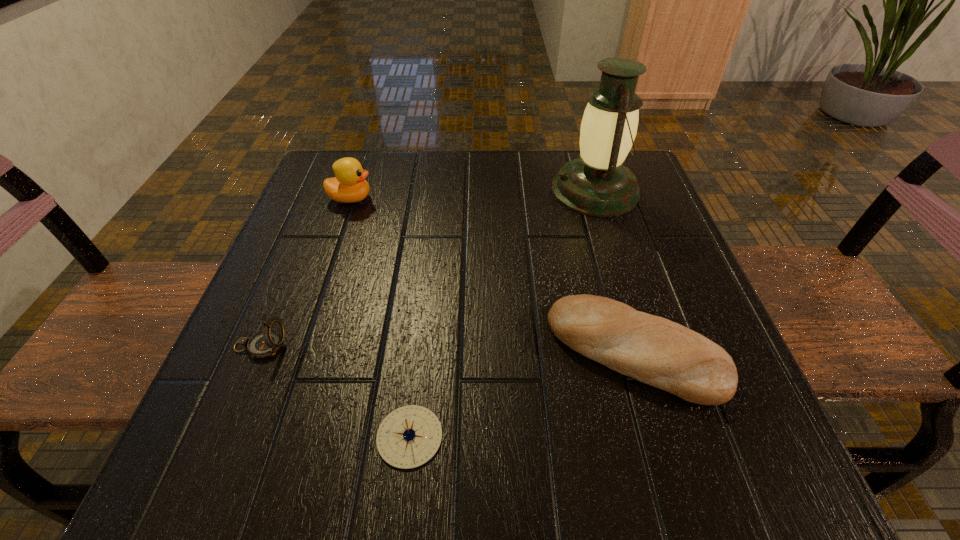
Find the location of a particular element. The height and width of the screenshot is (540, 960). vacant area that lies between the farther compass and the duckling is located at coordinates (306, 272).

Where is `free area in between the lantern and the left compass`? Image resolution: width=960 pixels, height=540 pixels. free area in between the lantern and the left compass is located at coordinates (428, 268).

At what (x,y) coordinates should I click in order to perform the action: click on free space between the farther compass and the third object from left to right. Please return your answer as a coordinate pair (x, y). The height and width of the screenshot is (540, 960). Looking at the image, I should click on (335, 391).

Find the location of a particular element. empty location between the bread and the shortest object is located at coordinates (522, 394).

The width and height of the screenshot is (960, 540). Identify the location of vacant area that lies between the farther compass and the lantern. (428, 268).

Where is `free space between the fourth shortest object and the left compass`? free space between the fourth shortest object and the left compass is located at coordinates (306, 272).

At what (x,y) coordinates should I click in order to perform the action: click on free space between the bread and the nearer compass. Please return your answer as a coordinate pair (x, y). Looking at the image, I should click on (522, 394).

Find the location of a particular element. vacant point located between the left compass and the second shortest object is located at coordinates (448, 349).

Find the location of a particular element. blank region between the fourth tallest object and the lantern is located at coordinates (615, 271).

Identify which object is located as the fourth nearest to the tallest object. Please provide its 2D coordinates. Your answer should be formatted as a tuple, i.e. [(x, y)], where the tuple contains the x and y coordinates of a point satisfying the conditions above.

[(265, 343)]